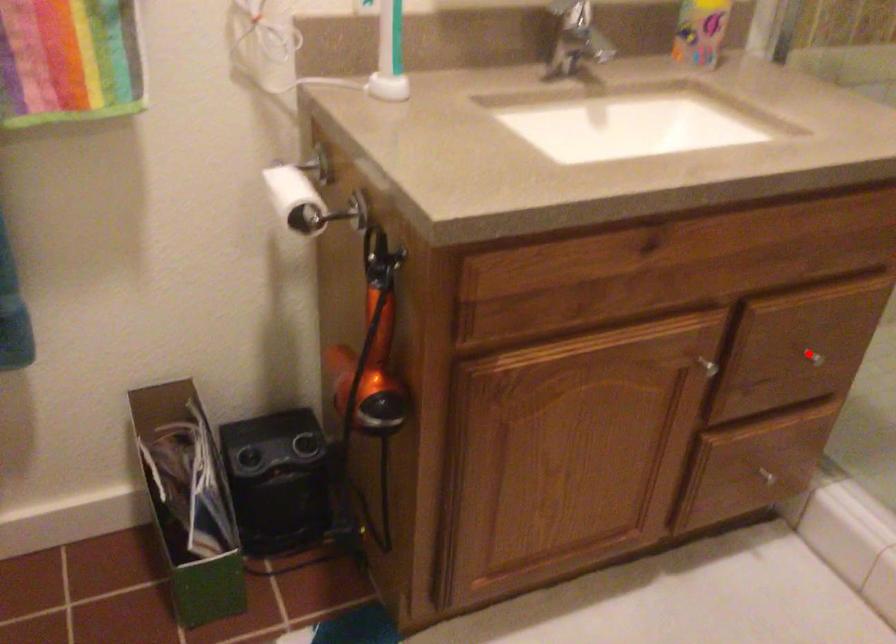
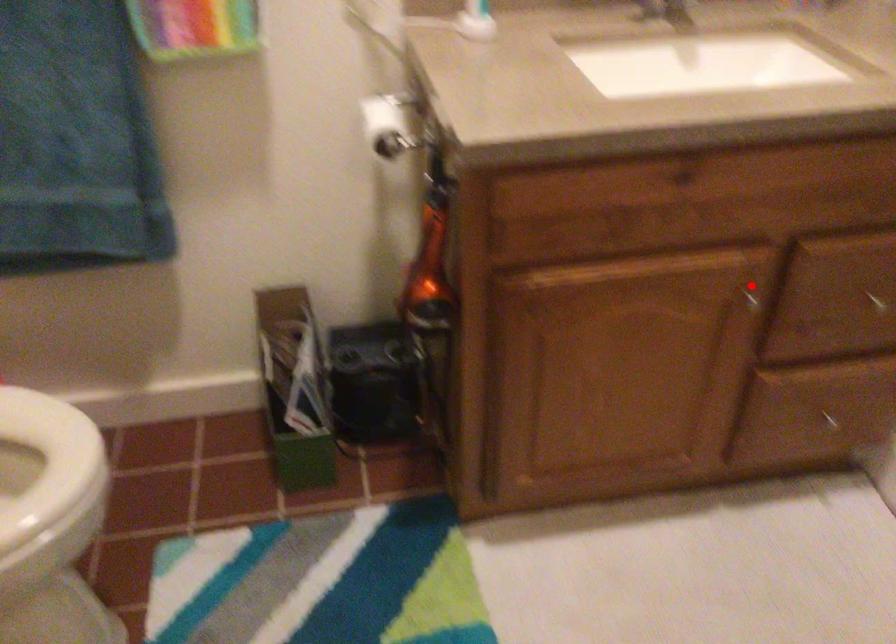
I am providing you with two images of the same scene from different viewpoints. A red point is marked on the first image and another point is marked on the second image. Are the points marked in image1 and image2 representing the same 3D position?

No